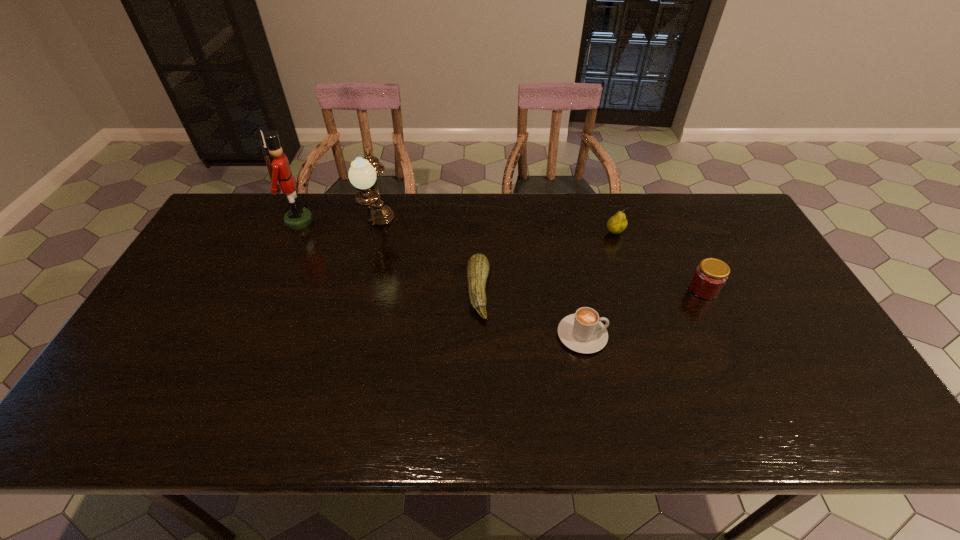
This screenshot has height=540, width=960. I want to click on vacant space at the near edge of the desktop, so click(453, 420).

In the image, there is a desktop. Where is `free space at the right edge`? This screenshot has width=960, height=540. free space at the right edge is located at coordinates (740, 239).

Where is `vacant space at the far right corner of the desktop`? vacant space at the far right corner of the desktop is located at coordinates (717, 196).

This screenshot has height=540, width=960. Identify the location of vacant space at the near right corner of the desktop. (867, 408).

At what (x,y) coordinates should I click in order to perform the action: click on free space between the oil lamp and the nutcracker. Please return your answer as a coordinate pair (x, y). This screenshot has width=960, height=540. Looking at the image, I should click on (339, 224).

This screenshot has height=540, width=960. I want to click on empty space that is in between the rightmost object and the cappuccino, so click(x=643, y=313).

Identify the location of vacant space that's between the second object from left to right and the jam. This screenshot has height=540, width=960. (541, 258).

The width and height of the screenshot is (960, 540). I want to click on free space between the cappuccino and the shortest object, so click(530, 313).

The height and width of the screenshot is (540, 960). Identify the location of free space between the fifth object from right to left and the pear. (497, 230).

Where is `free space between the second object from left to right and the zucchini`? The width and height of the screenshot is (960, 540). free space between the second object from left to right and the zucchini is located at coordinates (428, 259).